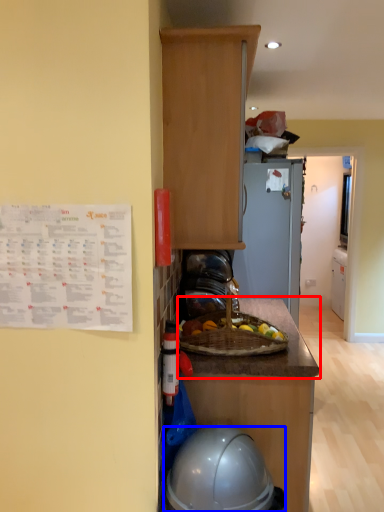
Question: Among these objects, which one is farthest to the camera, countertop (highlighted by a red box) or helmet (highlighted by a blue box)?

Choices:
 (A) countertop
 (B) helmet

Answer: (A)